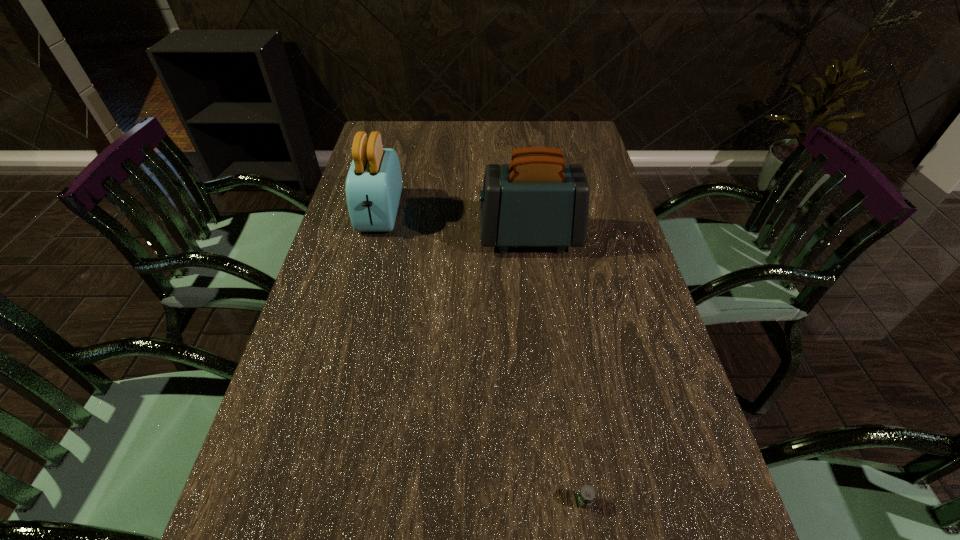
I want to click on the right toaster, so click(537, 200).

Identify the location of the left toaster. This screenshot has height=540, width=960. (374, 182).

Where is `the nearest object`? The width and height of the screenshot is (960, 540). the nearest object is located at coordinates (586, 495).

Locate an element on the screen. The height and width of the screenshot is (540, 960). the shortest object is located at coordinates (586, 495).

The image size is (960, 540). I want to click on free space located 0.330m on the front-facing side of the right toaster, so click(363, 237).

Where is `free point located on the front-facing side of the right toaster`? free point located on the front-facing side of the right toaster is located at coordinates (338, 237).

Where is `blank space located on the front-facing side of the right toaster`? blank space located on the front-facing side of the right toaster is located at coordinates (370, 237).

You are a GUI agent. You are given a task and a screenshot of the screen. Output one action in this format:
    pyautogui.click(x=<x>, y=<y>)
    Task: Click on the blank area located 0.190m on the side of the left toaster with the lever
    The width and height of the screenshot is (960, 540).
    Given the screenshot: What is the action you would take?
    pyautogui.click(x=361, y=289)

I want to click on free region located 0.370m on the left of the shortest object, so click(339, 501).

Locate an element on the screen. This screenshot has width=960, height=540. object situated at the left edge is located at coordinates (374, 182).